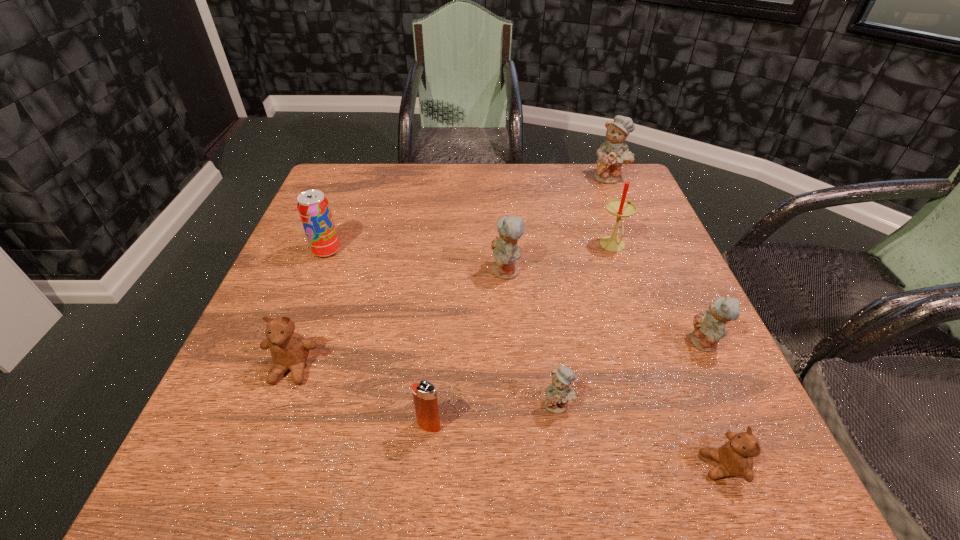
The width and height of the screenshot is (960, 540). What are the coordinates of `vacant space positioned 0.380m on the right of the soda can` in the screenshot? It's located at (502, 251).

Find the location of a particular element. free region located on the front-facing side of the second nearest blue teddy bear is located at coordinates (558, 343).

Where is `free space located on the front-facing side of the second nearest blue teddy bear`? Image resolution: width=960 pixels, height=540 pixels. free space located on the front-facing side of the second nearest blue teddy bear is located at coordinates (600, 343).

Find the location of a particular element. The height and width of the screenshot is (540, 960). vacant space located on the front-facing side of the second nearest blue teddy bear is located at coordinates (648, 343).

I want to click on free space located 0.110m on the face of the farther brown teddy bear, so click(x=262, y=448).

Find the location of a particular element. The image size is (960, 540). free point located on the left of the third object from left to right is located at coordinates (368, 425).

What are the coordinates of `vacant space located on the front-facing side of the nearest blue teddy bear` in the screenshot? It's located at (564, 444).

This screenshot has height=540, width=960. I want to click on vacant area situated 0.140m on the face of the nearest teddy bear, so click(x=610, y=466).

Identify the location of vacant space located on the face of the nearest teddy bear. (444, 466).

Identify the location of free space located on the face of the nearest teddy bear. (491, 466).